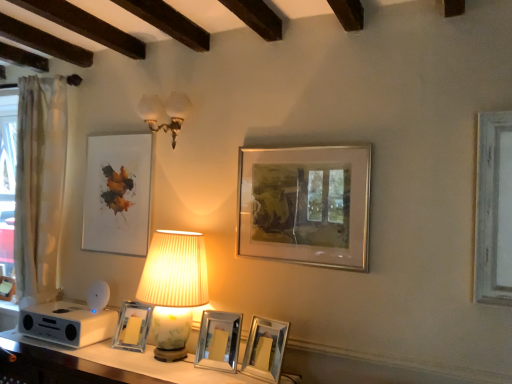
The height and width of the screenshot is (384, 512). In order to click on vacant location below matte white lampshade at center, acting as the second lamp starting from the top (from a real-world perspective) in this screenshot , I will do `click(159, 361)`.